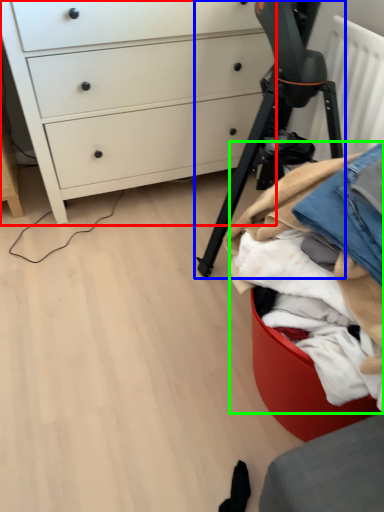
Question: Which object is positioned farthest from chest of drawers (highlighted by a red box)? Select from tripod (highlighted by a blue box) and clothing (highlighted by a green box).

Choices:
 (A) tripod
 (B) clothing

Answer: (B)